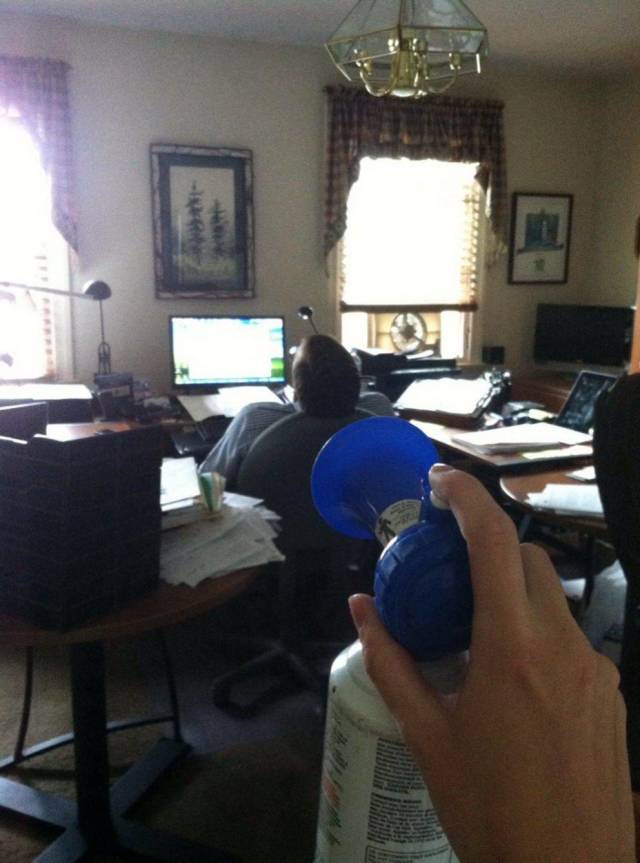
I want to click on round office table on left, so click(x=173, y=596).